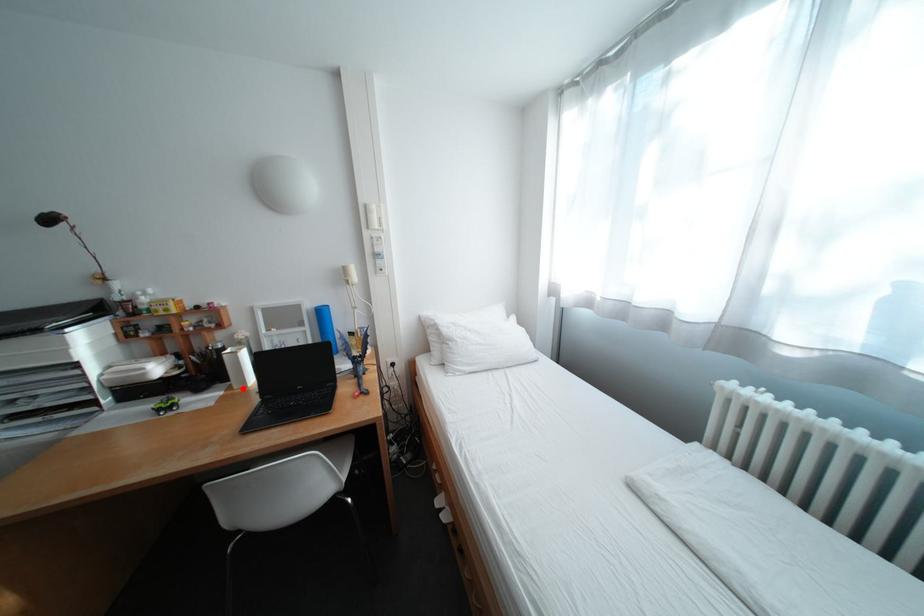
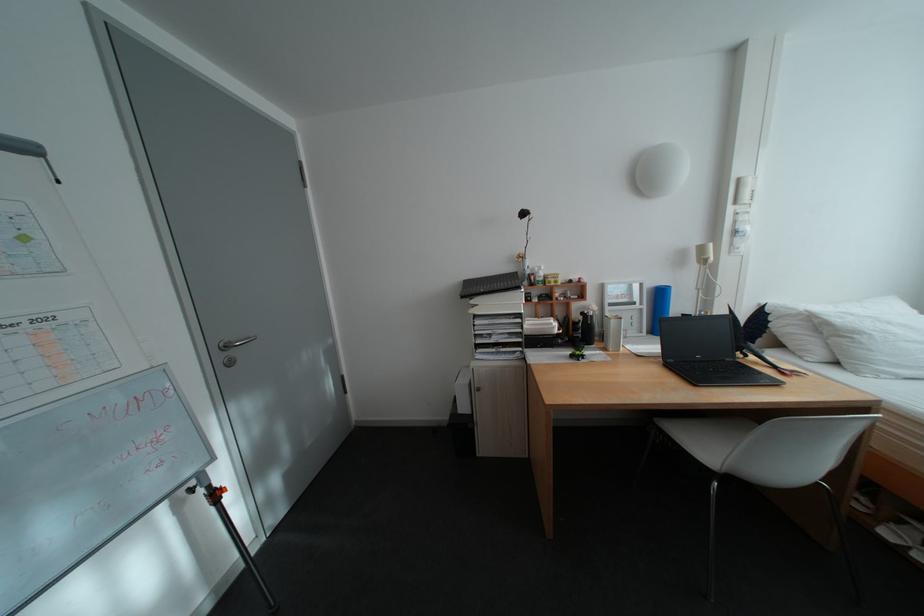
Find the pixel in the second image that matches the highlighted location in the first image.

(617, 350)